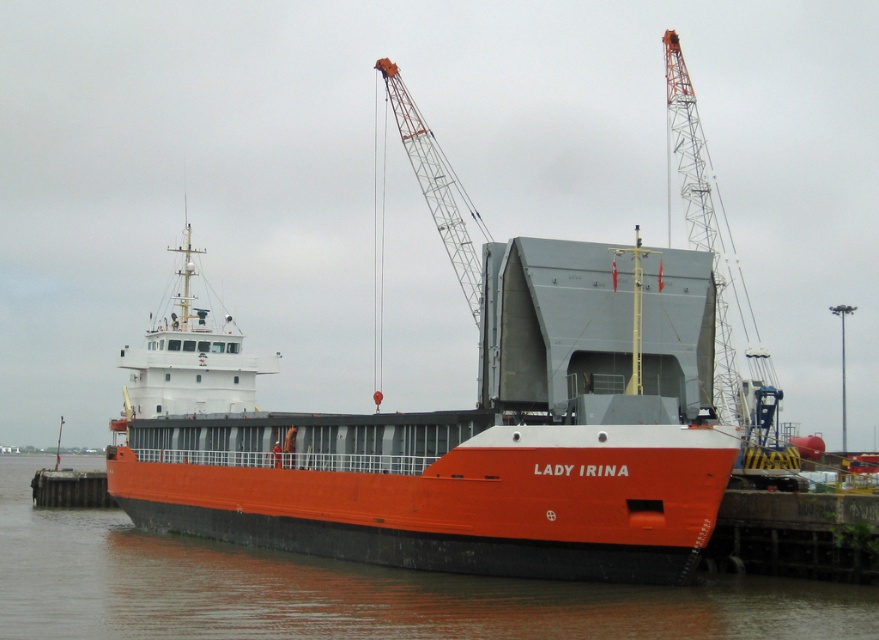
You are standing on the dock next to the ship LADY IRINA. You see a point marked at coordinates (x=351, y=589). What is the object located at this point?

The point at coordinates (x=351, y=589) corresponds to the orange matte water at lower center.

You are standing on the dock next to the orange matte cargo ship at center. You want to throw a small floating toy into the water. Which direction should you throw it so that it ends up in the orange matte water at lower center?

The orange matte cargo ship at center is above orange matte water at lower center, so you should throw the toy downward towards the orange matte water at lower center.

In the scene shown: You are a crane operator on the metallic gray crane at upper center. You need to move a container from the ship to the smooth concrete dock at lower left. Considering the width of the crane and the dock, will the container fit on the dock?

The metallic gray crane at upper center is wider than the smooth concrete dock at lower left, so the container may not fit on the dock due to the dock being narrower than the crane.